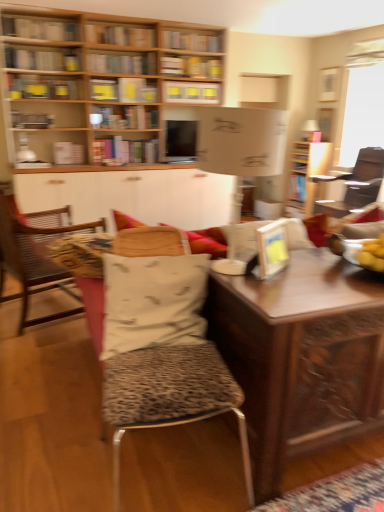
Question: Is leopard print cushion at left facing away from wooden table at center?

Choices:
 (A) no
 (B) yes

Answer: (A)

Question: From a real-world perspective, is leopard print cushion at left below wooden table at center?

Choices:
 (A) no
 (B) yes

Answer: (A)

Question: Is the surface of leopard print cushion at left in direct contact with wooden table at center?

Choices:
 (A) yes
 (B) no

Answer: (B)

Question: Does leopard print cushion at left have a lesser height compared to wooden table at center?

Choices:
 (A) no
 (B) yes

Answer: (A)

Question: From the image's perspective, is leopard print cushion at left on top of wooden table at center?

Choices:
 (A) yes
 (B) no

Answer: (A)

Question: Considering the relative sizes of leopard print cushion at left and wooden table at center in the image provided, is leopard print cushion at left wider than wooden table at center?

Choices:
 (A) yes
 (B) no

Answer: (B)

Question: Can you confirm if wooden desk at center is bigger than leopard print fabric stool at center?

Choices:
 (A) yes
 (B) no

Answer: (A)

Question: Is the surface of wooden desk at center in direct contact with leopard print fabric stool at center?

Choices:
 (A) yes
 (B) no

Answer: (B)

Question: From a real-world perspective, is wooden desk at center located higher than leopard print fabric stool at center?

Choices:
 (A) no
 (B) yes

Answer: (A)

Question: Does wooden desk at center appear on the left side of leopard print fabric stool at center?

Choices:
 (A) no
 (B) yes

Answer: (A)

Question: Could you tell me if wooden desk at center is facing leopard print fabric stool at center?

Choices:
 (A) no
 (B) yes

Answer: (A)

Question: Is wooden desk at center looking in the opposite direction of leopard print fabric stool at center?

Choices:
 (A) yes
 (B) no

Answer: (B)

Question: Does metallic silver bookshelf at upper left, acting as the second book starting from the bottom, have a greater height compared to hardcover book at upper center, the seventh book from the bottom?

Choices:
 (A) yes
 (B) no

Answer: (B)